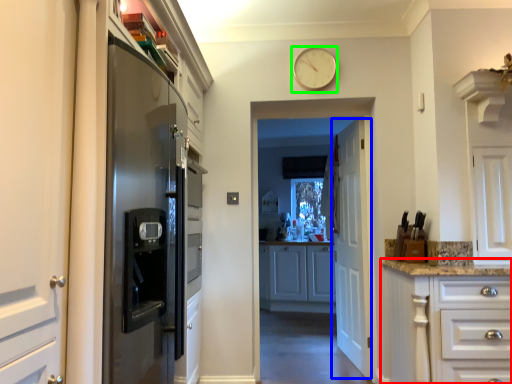
Question: Which object is the closest to the cabinetry (highlighted by a red box)? Choose among these: door (highlighted by a blue box) or clock (highlighted by a green box).

Choices:
 (A) door
 (B) clock

Answer: (A)